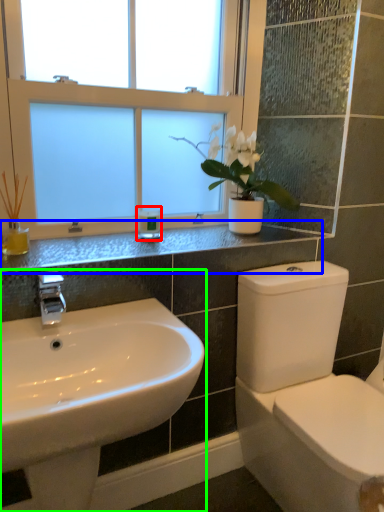
Question: Which object is the closest to the toiletry (highlighted by a red box)? Choose among these: counter top (highlighted by a blue box) or sink (highlighted by a green box).

Choices:
 (A) counter top
 (B) sink

Answer: (A)